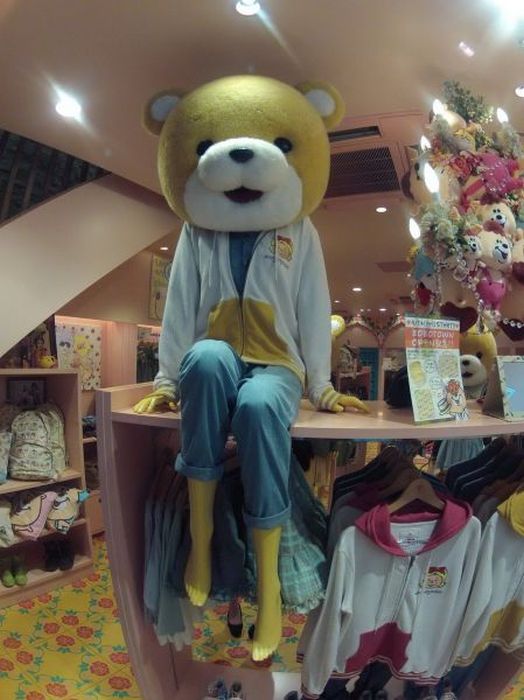
You are a GUI agent. You are given a task and a screenshot of the screen. Output one action in this format:
    pyautogui.click(x=<x>, y=<y>)
    Task: Click on the floor
    The image size is (524, 700).
    Given the screenshot: What is the action you would take?
    pyautogui.click(x=57, y=638)